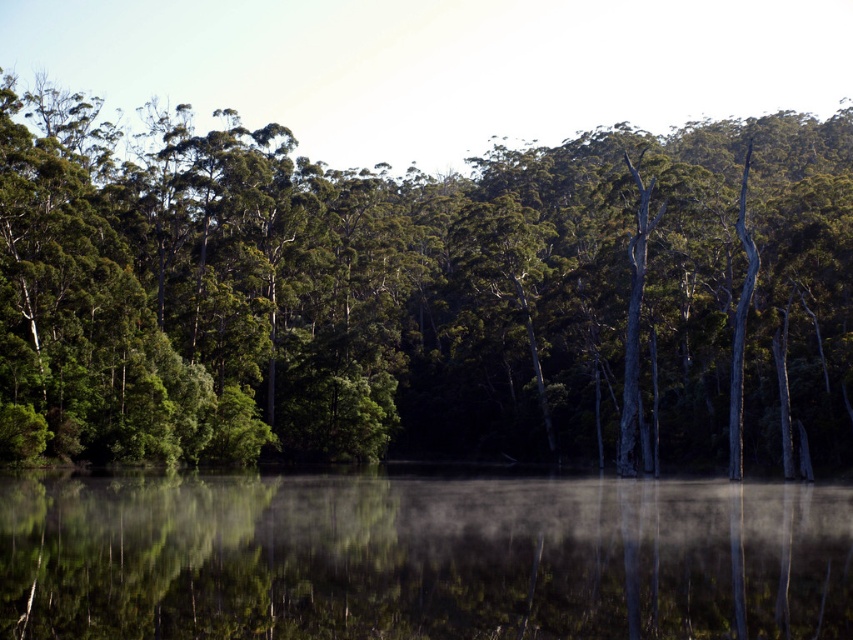
Can you confirm if green matte tree at center is thinner than transparent misty water at center?

No, green matte tree at center is not thinner than transparent misty water at center.

Which is behind, point (611, 369) or point (671, 625)?

Positioned behind is point (611, 369).

What do you see at coordinates (422, 296) in the screenshot?
I see `green matte tree at center` at bounding box center [422, 296].

What are the coordinates of `green matte tree at center` in the screenshot? It's located at (422, 296).